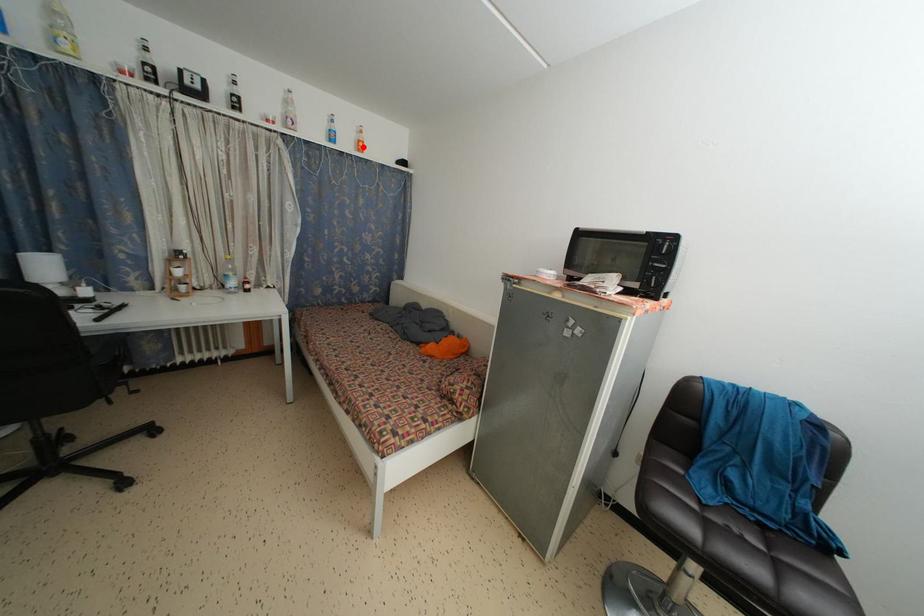
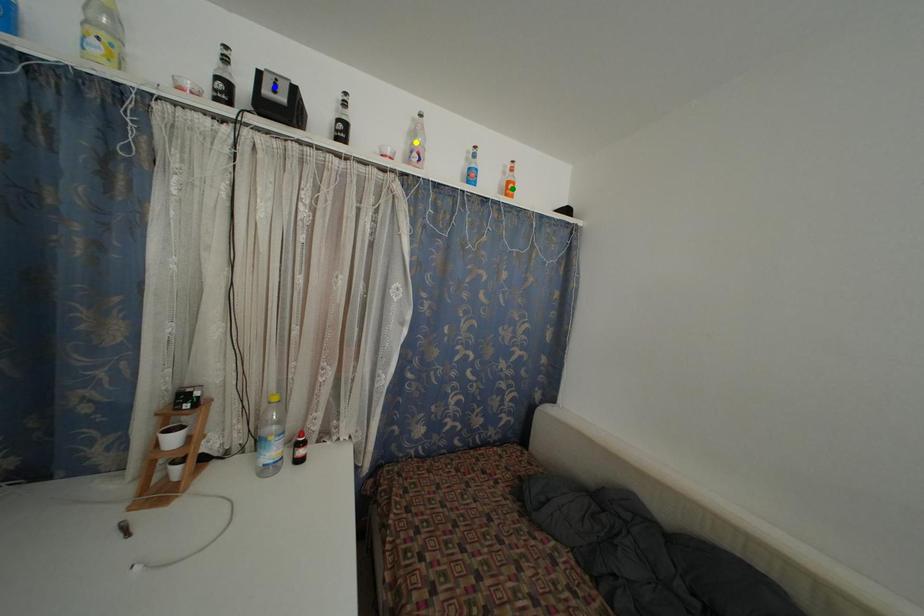
Question: I am providing you with two images of the same scene from different viewpoints. A red point is marked on the first image. You are given multiple points on the second image. Which spot in image 2 lines up with the point in image 1?

Choices:
 (A) green point
 (B) blue point
 (C) yellow point

Answer: (A)